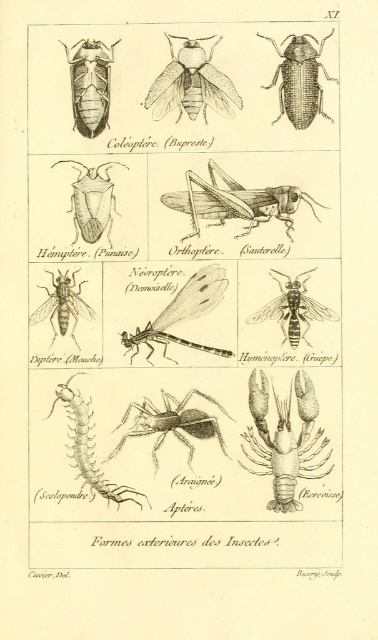
In the botanical illustration labeled Formes exterieures des Insectes, there are several insects displayed in three rows. You are looking at the top row which includes a Coleoptere Bupreste and a Hemiptere Punaise. You notice a black matte beetle at upper right. Where exactly is this beetle located in the illustration?

The black matte beetle at upper right is located at point (300, 80) in the illustration.

Based on the coordinates provided in the image, where exactly is the translucent yellowish lobster at lower right located?

The translucent yellowish lobster at lower right is located at point (285, 440).